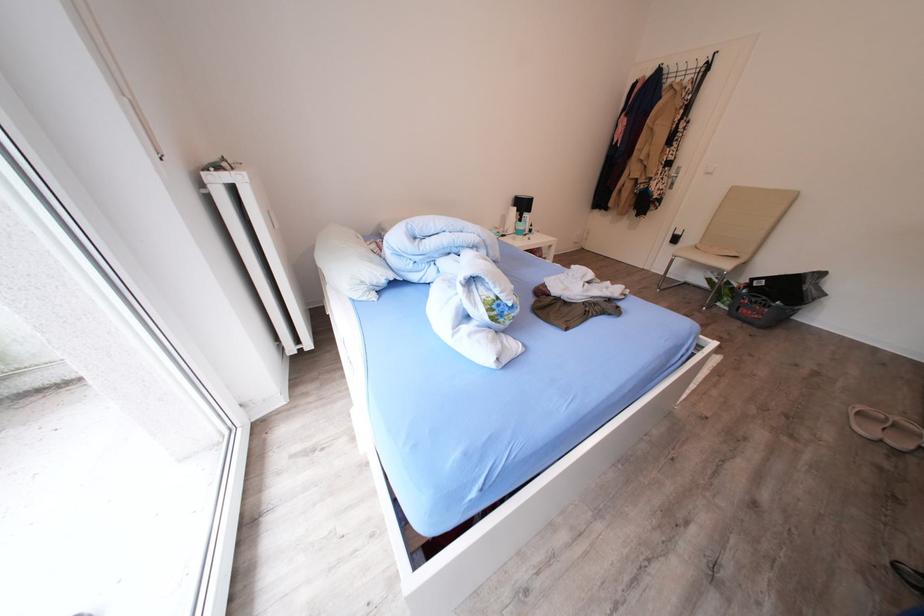
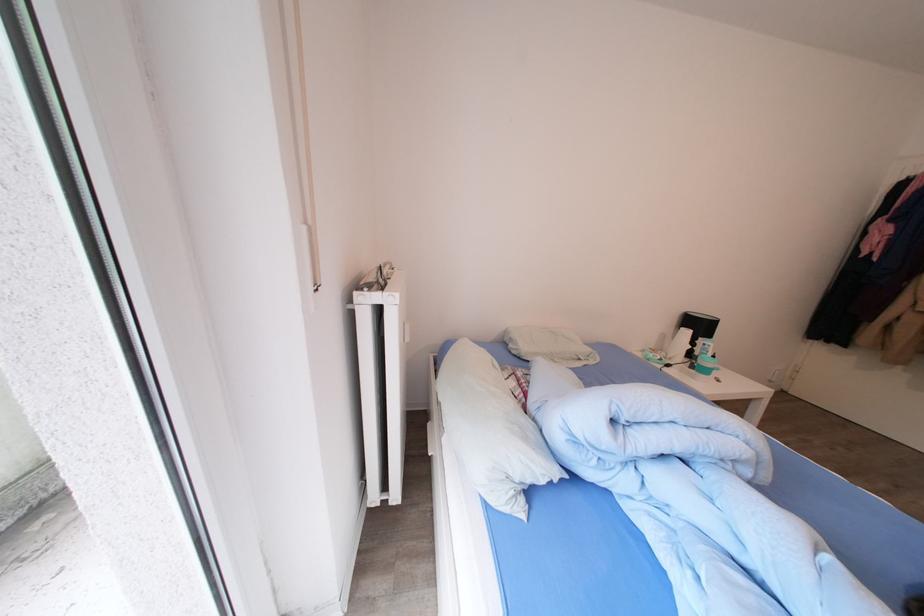
Question: The images are taken continuously from a first-person perspective. In which direction is your viewpoint rotating?

Choices:
 (A) Left
 (B) Right
 (C) Up
 (D) Down

Answer: (A)